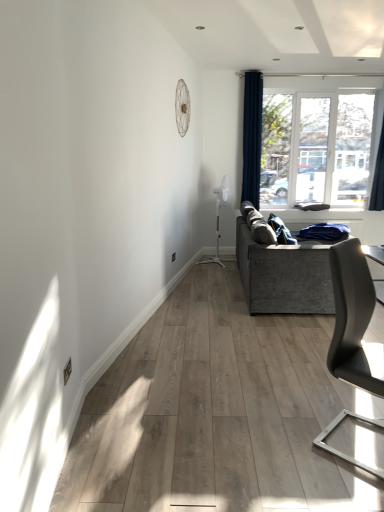
Identify the location of vacant space situated on the left part of matte gray chair at right. The height and width of the screenshot is (512, 384). (283, 436).